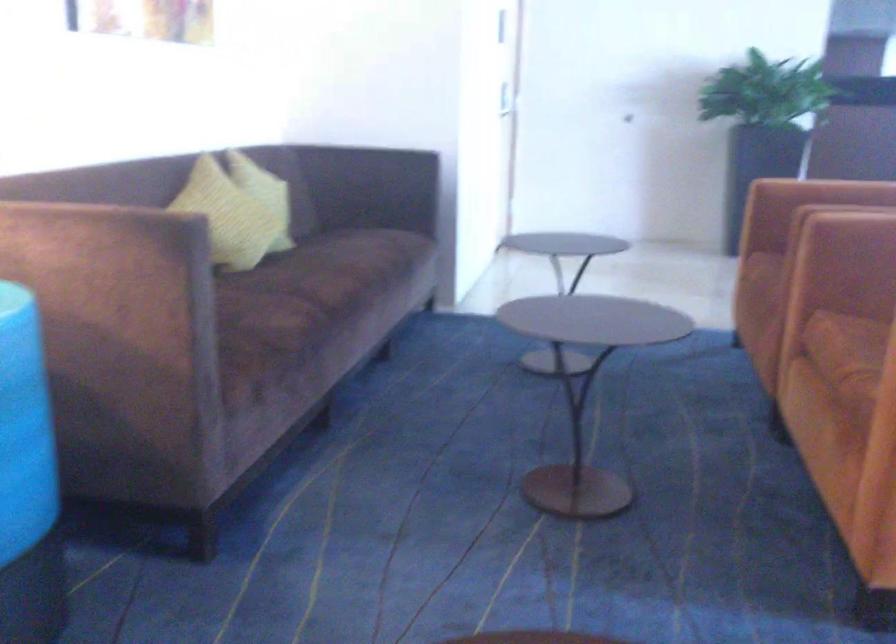
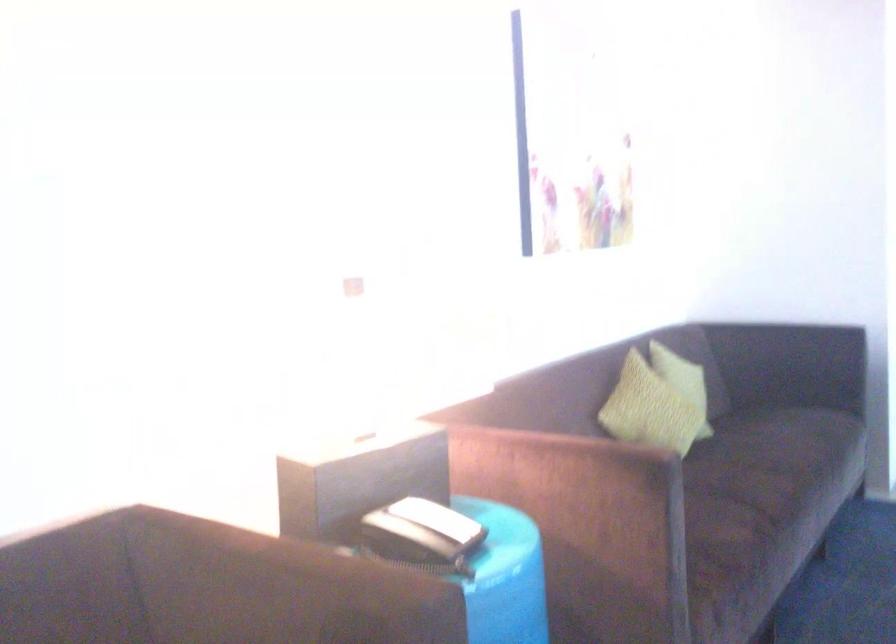
The point at (317,301) is marked in the first image. Where is the corresponding point in the second image?

(768, 489)